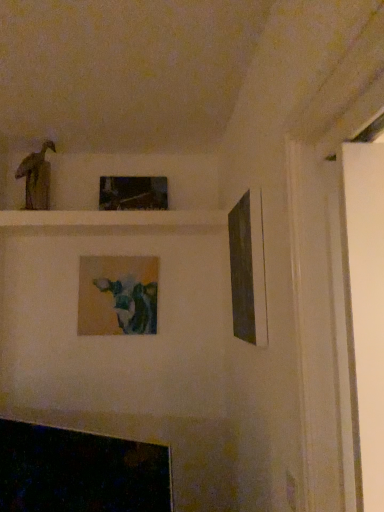
Question: Is metallic reflective frame at upper center, which is the 2th picture frame from left to right, turned away from matte brown statue at upper left?

Choices:
 (A) no
 (B) yes

Answer: (A)

Question: Considering the relative sizes of metallic reflective frame at upper center, the first picture frame in the back-to-front sequence, and matte brown statue at upper left in the image provided, is metallic reflective frame at upper center, the first picture frame in the back-to-front sequence, bigger than matte brown statue at upper left?

Choices:
 (A) no
 (B) yes

Answer: (B)

Question: Is metallic reflective frame at upper center, the first picture frame in the back-to-front sequence, closer to the viewer compared to matte brown statue at upper left?

Choices:
 (A) no
 (B) yes

Answer: (A)

Question: From a real-world perspective, does metallic reflective frame at upper center, which is the 2th picture frame from left to right, stand above matte brown statue at upper left?

Choices:
 (A) no
 (B) yes

Answer: (A)

Question: Could you tell me if metallic reflective frame at upper center, the first picture frame in the back-to-front sequence, is facing matte brown statue at upper left?

Choices:
 (A) yes
 (B) no

Answer: (B)

Question: Can you confirm if metallic reflective frame at upper center, placed as the 2th picture frame when sorted from right to left, is taller than matte brown statue at upper left?

Choices:
 (A) yes
 (B) no

Answer: (B)

Question: Is matte black picture frame at right, which is the first picture frame from front to back, positioned in front of metallic reflective frame at upper center, placed as the 2th picture frame when sorted from right to left?

Choices:
 (A) no
 (B) yes

Answer: (B)

Question: Is matte black picture frame at right, which is the first picture frame from front to back, to the right of metallic reflective frame at upper center, placed as the 2th picture frame when sorted from right to left, from the viewer's perspective?

Choices:
 (A) no
 (B) yes

Answer: (B)

Question: Is matte black picture frame at right, which is the first picture frame from front to back, far from metallic reflective frame at upper center, placed as the 2th picture frame when sorted from right to left?

Choices:
 (A) yes
 (B) no

Answer: (B)

Question: Is matte black picture frame at right, which is the first picture frame from front to back, outside of metallic reflective frame at upper center, the first picture frame in the back-to-front sequence?

Choices:
 (A) no
 (B) yes

Answer: (B)

Question: Considering the relative sizes of matte black picture frame at right, which is the first picture frame from front to back, and metallic reflective frame at upper center, which is the 3th picture frame in front-to-back order, in the image provided, is matte black picture frame at right, which is the first picture frame from front to back, thinner than metallic reflective frame at upper center, which is the 3th picture frame in front-to-back order,?

Choices:
 (A) no
 (B) yes

Answer: (B)

Question: From a real-world perspective, is matte black picture frame at right, arranged as the first picture frame when viewed from the right, located beneath metallic reflective frame at upper center, which is the 3th picture frame in front-to-back order?

Choices:
 (A) yes
 (B) no

Answer: (A)

Question: From the image's perspective, is matte brown statue at upper left above matte black picture frame at right, which is the third picture frame from back to front?

Choices:
 (A) yes
 (B) no

Answer: (A)